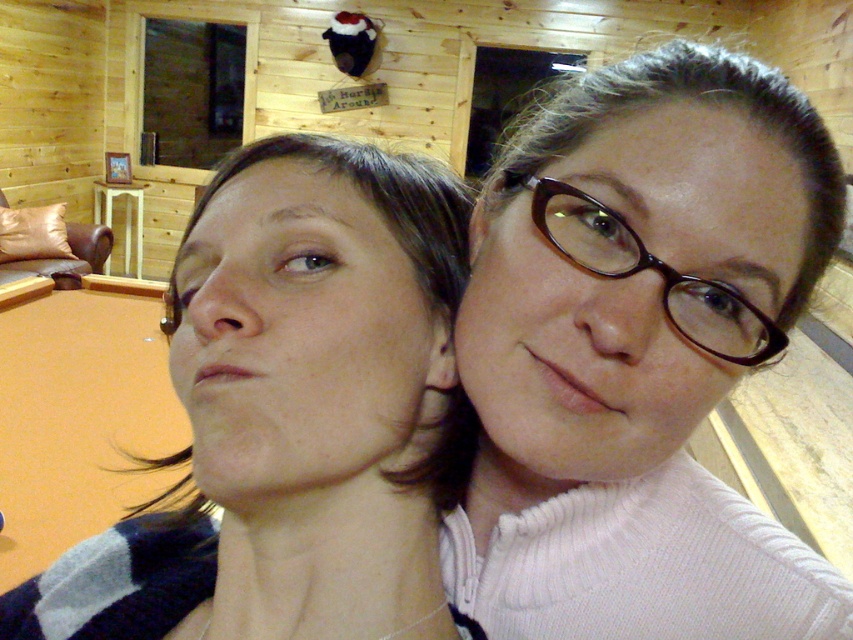
Question: Is white knit sweater at center to the left of orange felt billiard table at lower left from the viewer's perspective?

Choices:
 (A) yes
 (B) no

Answer: (B)

Question: Is white knit sweater at center further to the viewer compared to orange felt billiard table at lower left?

Choices:
 (A) yes
 (B) no

Answer: (B)

Question: Which point is farther to the camera?

Choices:
 (A) white knit sweater at center
 (B) matte blue sweater at left

Answer: (B)

Question: Is matte blue sweater at left further to the viewer compared to orange felt billiard table at lower left?

Choices:
 (A) no
 (B) yes

Answer: (A)

Question: Among these objects, which one is farthest from the camera?

Choices:
 (A) orange felt billiard table at lower left
 (B) matte blue sweater at left
 (C) brown glossy glasses at center

Answer: (A)

Question: Which of the following is the farthest from the observer?

Choices:
 (A) matte blue sweater at left
 (B) white knit sweater at center

Answer: (A)